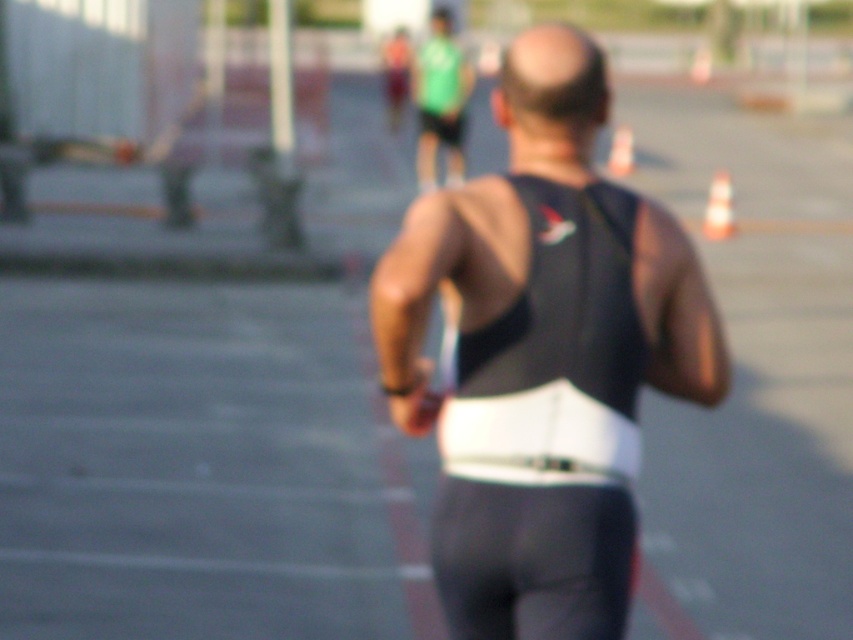
Question: Does black matte triathlon suit at center have a smaller size compared to black matte vest at center?

Choices:
 (A) no
 (B) yes

Answer: (A)

Question: Is black matte triathlon suit at center thinner than white plastic cone at upper center?

Choices:
 (A) no
 (B) yes

Answer: (A)

Question: Among these objects, which one is farthest from the camera?

Choices:
 (A) black matte vest at center
 (B) white plastic cone at upper center
 (C) black matte triathlon suit at center

Answer: (B)

Question: Is white plastic traffic cone at right closer to the viewer compared to white plastic cone at upper center?

Choices:
 (A) no
 (B) yes

Answer: (B)

Question: Based on their relative distances, which object is nearer to the black matte triathlon suit at center?

Choices:
 (A) white plastic traffic cone at right
 (B) white plastic cone at upper center
 (C) black matte vest at center

Answer: (C)

Question: Which point is farther from the camera taking this photo?

Choices:
 (A) (524, 113)
 (B) (624, 168)
 (C) (531, 192)

Answer: (B)